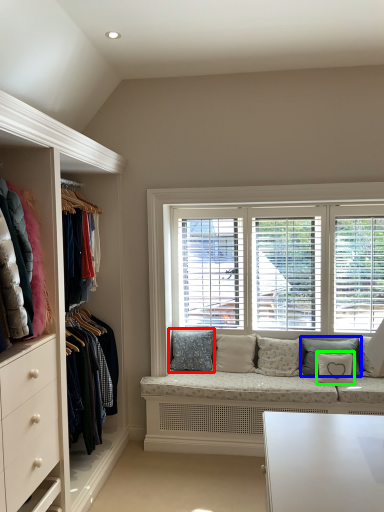
Question: Considering the real-world distances, which object is closest to pillow (highlighted by a red box)? pillow (highlighted by a blue box) or pillow (highlighted by a green box).

Choices:
 (A) pillow
 (B) pillow

Answer: (A)